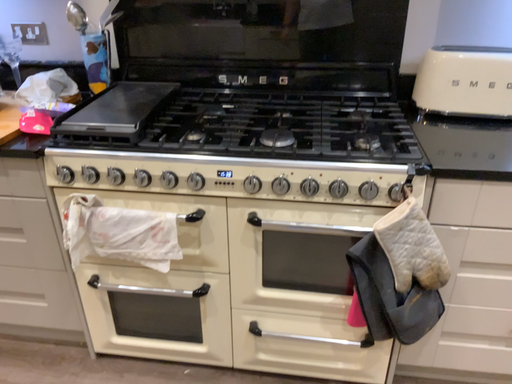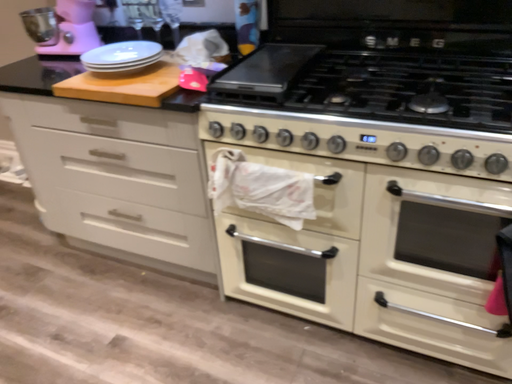
Question: Which way did the camera rotate in the video?

Choices:
 (A) rotated right
 (B) rotated left

Answer: (B)